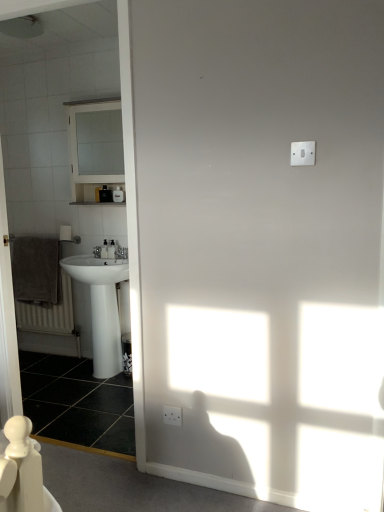
Find the location of `free location above black glossy tile at lower left (from a real-world perspective)`. free location above black glossy tile at lower left (from a real-world perspective) is located at coordinates (78, 391).